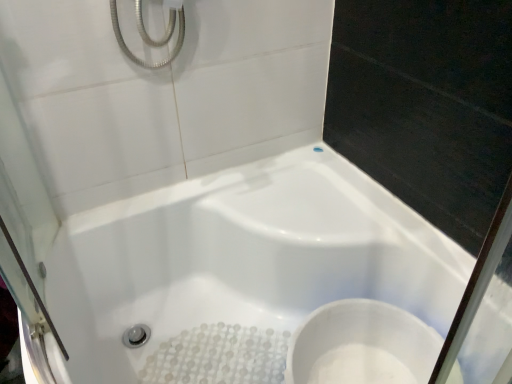
Question: From the image's perspective, is white glossy toilet at lower right positioned above or below white glossy bathtub at center?

Choices:
 (A) below
 (B) above

Answer: (A)

Question: Is white glossy toilet at lower right in front of or behind white glossy bathtub at center in the image?

Choices:
 (A) front
 (B) behind

Answer: (B)

Question: In terms of height, does white glossy toilet at lower right look taller or shorter compared to white glossy bathtub at center?

Choices:
 (A) short
 (B) tall

Answer: (A)

Question: Considering the relative positions of white glossy bathtub at center and white glossy toilet at lower right in the image provided, is white glossy bathtub at center to the left or to the right of white glossy toilet at lower right?

Choices:
 (A) left
 (B) right

Answer: (A)

Question: Is white glossy bathtub at center situated inside white glossy toilet at lower right or outside?

Choices:
 (A) inside
 (B) outside

Answer: (B)

Question: From a real-world perspective, relative to white glossy toilet at lower right, is white glossy bathtub at center vertically above or below?

Choices:
 (A) below
 (B) above

Answer: (A)

Question: Does point (59, 284) appear closer or farther from the camera than point (372, 316)?

Choices:
 (A) farther
 (B) closer

Answer: (B)